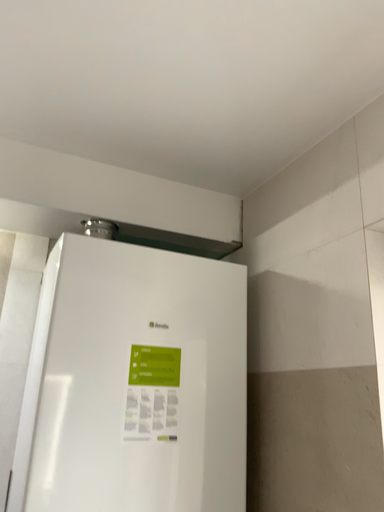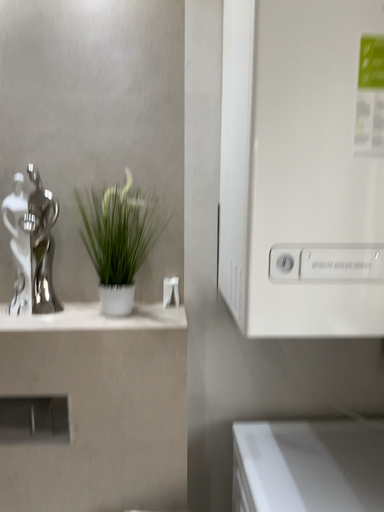
Question: Which way did the camera rotate in the video?

Choices:
 (A) rotated left
 (B) rotated right

Answer: (A)